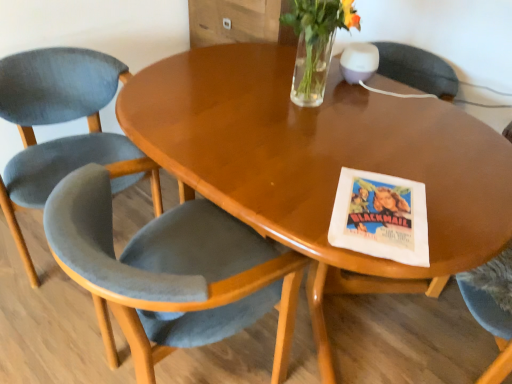
Question: Based on their sizes in the image, would you say glossy wood table at center is bigger or smaller than velvet grey chair at lower left, the first chair viewed from the right?

Choices:
 (A) small
 (B) big

Answer: (A)

Question: Visually, is glossy wood table at center positioned to the left or to the right of velvet grey chair at lower left, the first chair viewed from the right?

Choices:
 (A) right
 (B) left

Answer: (A)

Question: Estimate the real-world distances between objects in this image. Which object is farther from the velvet grey chair at lower left, the first chair viewed from the right?

Choices:
 (A) glossy wood table at center
 (B) velvet grey chair at left, which is counted as the 2th chair, starting from the right
 (C) clear glass vase at upper center

Answer: (C)

Question: Estimate the real-world distances between objects in this image. Which object is closer to the clear glass vase at upper center?

Choices:
 (A) velvet grey chair at lower left, marked as the 2th chair in a left-to-right arrangement
 (B) velvet grey chair at left, which is counted as the 2th chair, starting from the right
 (C) glossy wood table at center

Answer: (C)